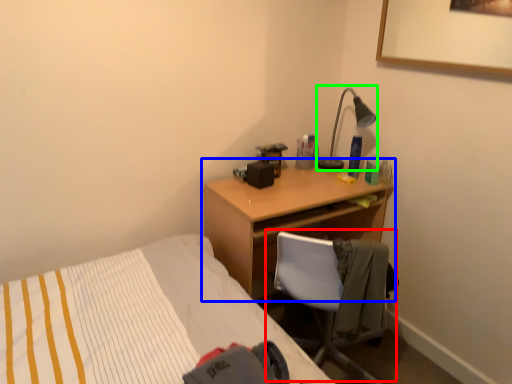
Question: Based on their relative distances, which object is farther from chair (highlighted by a red box)? Choose from desk (highlighted by a blue box) and lamp (highlighted by a green box).

Choices:
 (A) desk
 (B) lamp

Answer: (B)